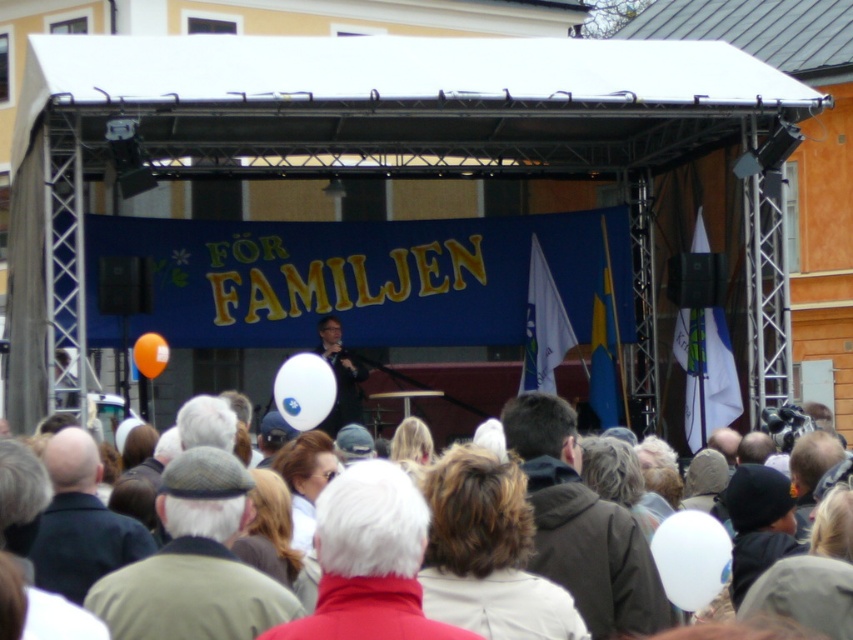
Please provide the coordinate of the gray woolen cap at center in the image.

The gray woolen cap at center is located at coordinate point (x=194, y=563).

You are attending an outdoor event and notice two items at the center of the stage. The gray woolen cap at center and the matte black microphone at center. Which one has a larger size?

The gray woolen cap at center is bigger than the matte black microphone at center.